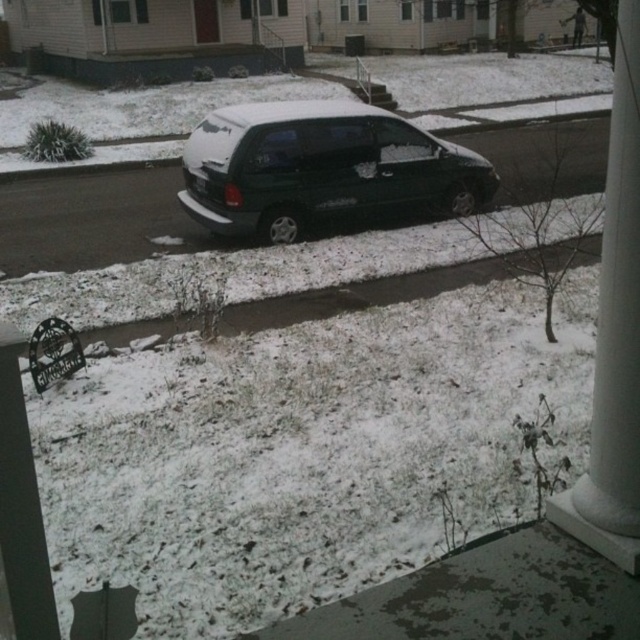
Consider the image. You are standing on the porch in the snowy scene and see a point marked at coordinates (x=320, y=168). What object is located at that point?

The point at (x=320, y=168) marks the shiny dark green minivan at center.

You are a delivery person trying to park your delivery van next to the shiny dark green minivan at center and the white smooth column at right. Based on the scene, which object should you avoid hitting because it is taller?

You should avoid hitting the shiny dark green minivan at center because it is much taller than the white smooth column at right.

You are standing on the porch and want to check if the shiny dark green minivan at center is within a 10 meter safety zone. Can you confirm if it is within the zone?

The shiny dark green minivan at center is 8.63 meters away from the viewer, which is within the 10 meter safety zone.